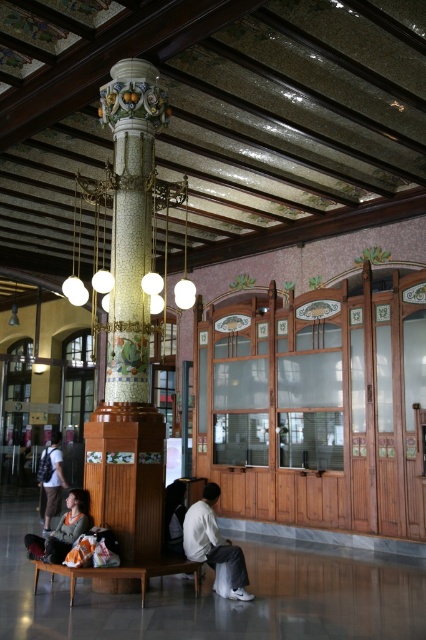
Question: Which of the following is the farthest from the observer?

Choices:
 (A) matte glass chandelier at center
 (B) matte gray sweater at lower left
 (C) matte black backpack at lower left

Answer: (C)

Question: Among these points, which one is farthest from the camera?

Choices:
 (A) (46, 538)
 (B) (218, 545)

Answer: (A)

Question: Does matte glass chandelier at center have a smaller size compared to white matte shirt at center?

Choices:
 (A) yes
 (B) no

Answer: (A)

Question: Which of the following is the farthest from the observer?

Choices:
 (A) (52, 540)
 (B) (187, 515)

Answer: (B)

Question: Can you confirm if white matte shirt at center is positioned below matte black backpack at lower left?

Choices:
 (A) yes
 (B) no

Answer: (B)

Question: Can you confirm if matte glass chandelier at center is positioned to the right of matte gray sweater at lower left?

Choices:
 (A) yes
 (B) no

Answer: (A)